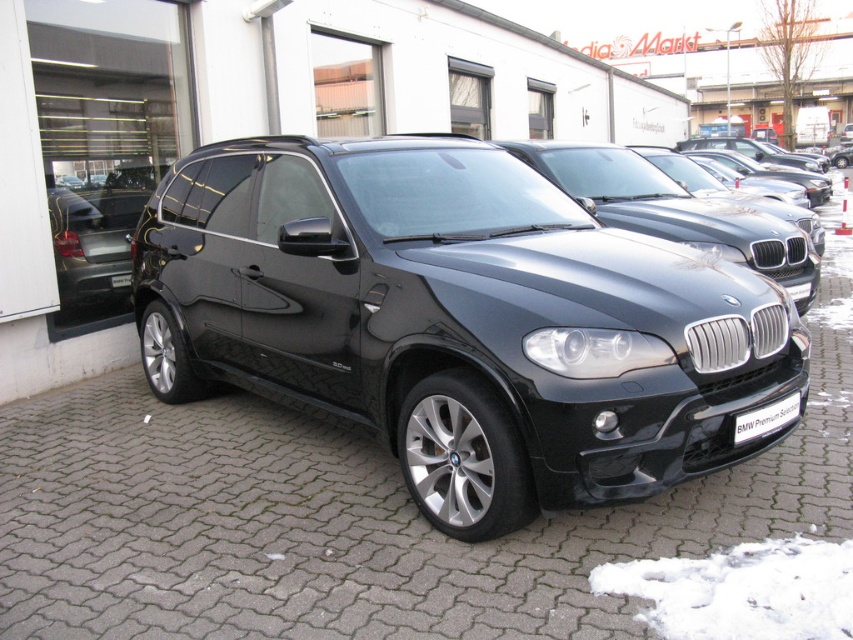
You are a delivery person trying to load a package onto the matte black suv at center. The package requires that it must be placed above the black plastic license plate at center. Can you do this based on the scene?

The matte black suv at center is much taller than the black plastic license plate at center, so yes, the package can be placed above the black plastic license plate at center since the suv has enough vertical space.

You are a photographer trying to capture the matte black suv at center and the black plastic license plate at center in a single shot. Given their sizes, which object will appear bigger in your photo?

The matte black suv at center is larger in size than the black plastic license plate at center, so it will appear bigger in the photo.